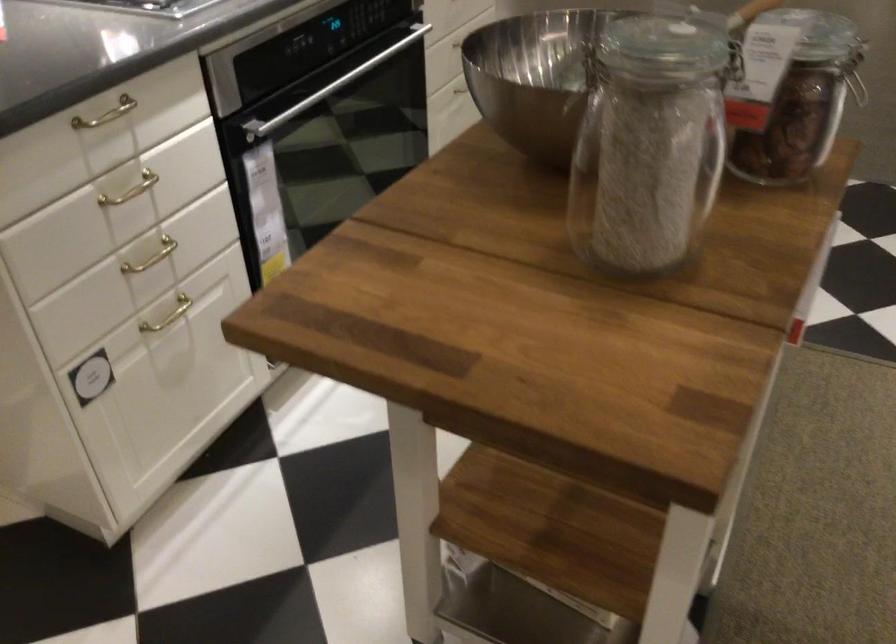
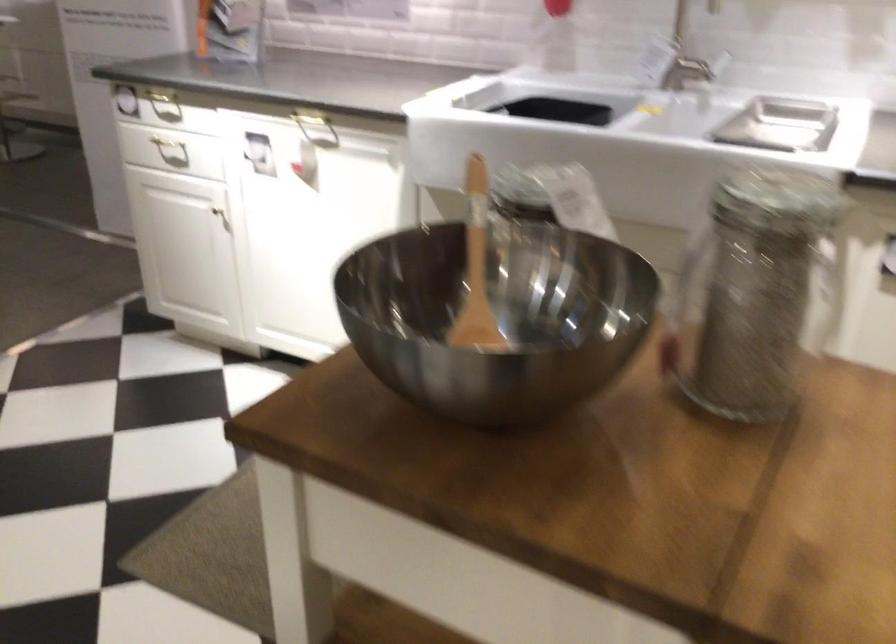
Based on the continuous images, in which direction is the camera rotating?

The camera's rotation is toward right-down.